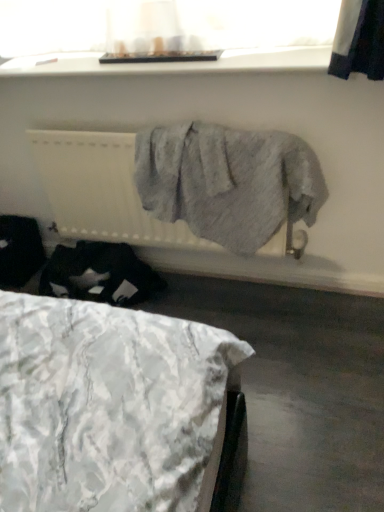
Question: From the image's perspective, is white smooth window sill at upper center beneath white textured fabric at lower left?

Choices:
 (A) yes
 (B) no

Answer: (B)

Question: Does white smooth window sill at upper center appear on the left side of white textured fabric at lower left?

Choices:
 (A) no
 (B) yes

Answer: (A)

Question: From a real-world perspective, is white smooth window sill at upper center positioned under white textured fabric at lower left based on gravity?

Choices:
 (A) no
 (B) yes

Answer: (A)

Question: Is white smooth window sill at upper center placed right next to white textured fabric at lower left?

Choices:
 (A) yes
 (B) no

Answer: (B)

Question: Considering the relative sizes of white smooth window sill at upper center and white textured fabric at lower left in the image provided, is white smooth window sill at upper center shorter than white textured fabric at lower left?

Choices:
 (A) yes
 (B) no

Answer: (B)

Question: Can you confirm if white smooth window sill at upper center is positioned to the right of white textured fabric at lower left?

Choices:
 (A) no
 (B) yes

Answer: (B)

Question: Is white textured radiator at center a part of white textured fabric at lower left?

Choices:
 (A) yes
 (B) no

Answer: (B)

Question: Can you confirm if white textured fabric at lower left is taller than white textured radiator at center?

Choices:
 (A) no
 (B) yes

Answer: (A)

Question: Is white textured fabric at lower left looking in the opposite direction of white textured radiator at center?

Choices:
 (A) no
 (B) yes

Answer: (A)

Question: Are white textured fabric at lower left and white textured radiator at center located far from each other?

Choices:
 (A) yes
 (B) no

Answer: (B)

Question: Is white textured fabric at lower left outside of white textured radiator at center?

Choices:
 (A) no
 (B) yes

Answer: (B)

Question: From a real-world perspective, is white textured fabric at lower left positioned over white textured radiator at center based on gravity?

Choices:
 (A) no
 (B) yes

Answer: (A)

Question: Considering the relative sizes of translucent fabric at upper center and white textured radiator at center in the image provided, is translucent fabric at upper center shorter than white textured radiator at center?

Choices:
 (A) yes
 (B) no

Answer: (A)